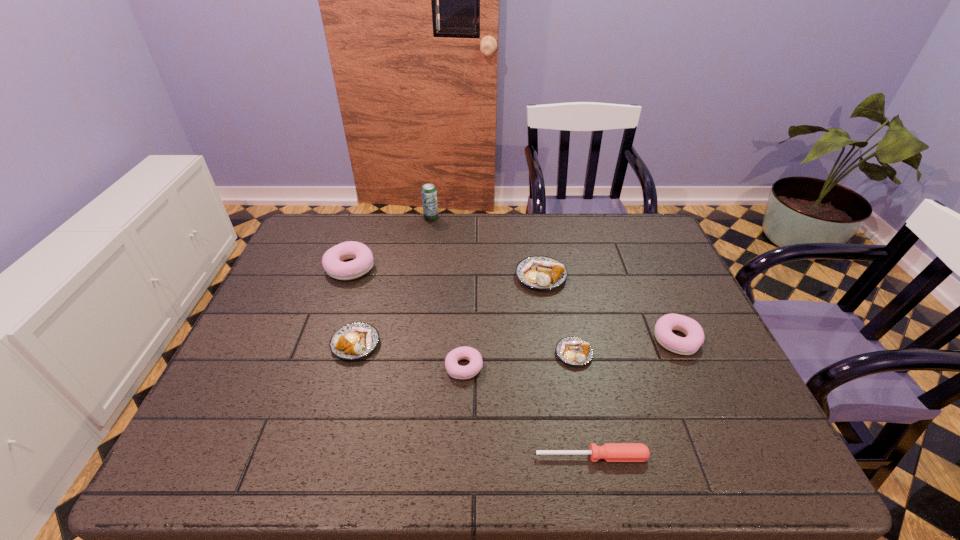
The image size is (960, 540). Find the location of `the second closest brown pastry to the rightmost pastry`. the second closest brown pastry to the rightmost pastry is located at coordinates click(x=538, y=272).

You are a GUI agent. You are given a task and a screenshot of the screen. Output one action in this format:
    pyautogui.click(x=<x>, y=<y>)
    Task: Click on the vacant space that satisfies the following two spatial constraints: 1. on the back side of the farthest pink pastry; 2. on the left side of the farthest object
    
    Given the screenshot: What is the action you would take?
    pyautogui.click(x=368, y=218)

The image size is (960, 540). What are the coordinates of `vacant area in the image that satisfies the following two spatial constraints: 1. on the front side of the smallest brown pastry; 2. on the left side of the farthest pink pastry` in the screenshot? It's located at (321, 354).

You are a GUI agent. You are given a task and a screenshot of the screen. Output one action in this format:
    pyautogui.click(x=<x>, y=<y>)
    Task: Click on the free spot that satisfies the following two spatial constraints: 1. on the front side of the third pastry from left to right; 2. on the right side of the screwdriver
    
    Given the screenshot: What is the action you would take?
    pyautogui.click(x=461, y=456)

This screenshot has height=540, width=960. Find the location of `vacant region that satisfies the following two spatial constraints: 1. on the front side of the third object from left to right; 2. on the left side of the smallest pink pastry`. vacant region that satisfies the following two spatial constraints: 1. on the front side of the third object from left to right; 2. on the left side of the smallest pink pastry is located at coordinates (409, 367).

You are a GUI agent. You are given a task and a screenshot of the screen. Output one action in this format:
    pyautogui.click(x=<x>, y=<y>)
    Task: Click on the free spot that satisfies the following two spatial constraints: 1. on the front side of the smallest pink pastry; 2. on the left side of the biggest pink pastry
    
    Given the screenshot: What is the action you would take?
    pyautogui.click(x=316, y=367)